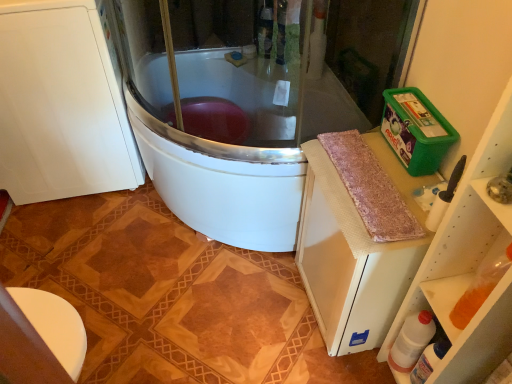
Where is `blank space situated above green plastic container at upper right, arranged as the 2th appliance when ordered from the bottom (from a real-world perspective)`? blank space situated above green plastic container at upper right, arranged as the 2th appliance when ordered from the bottom (from a real-world perspective) is located at coordinates (423, 114).